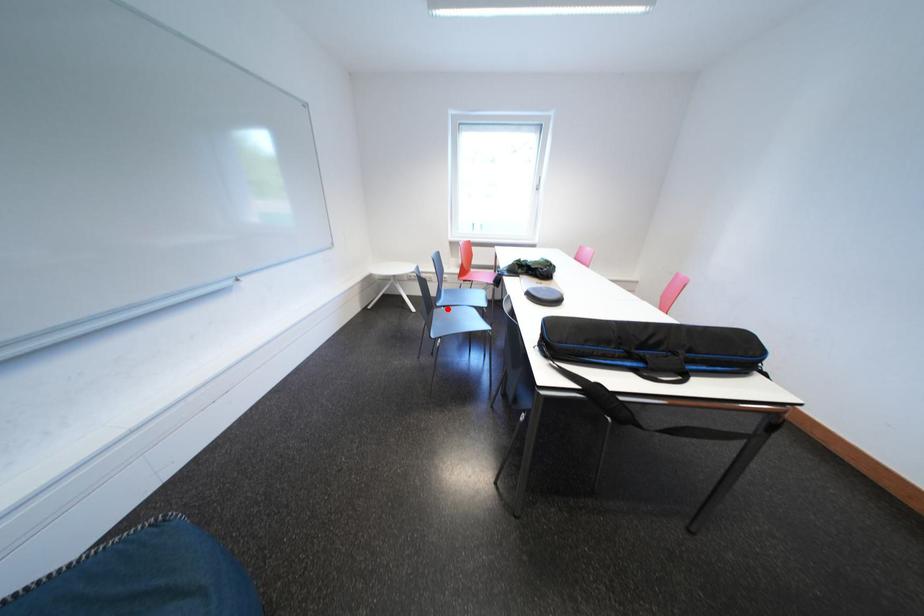
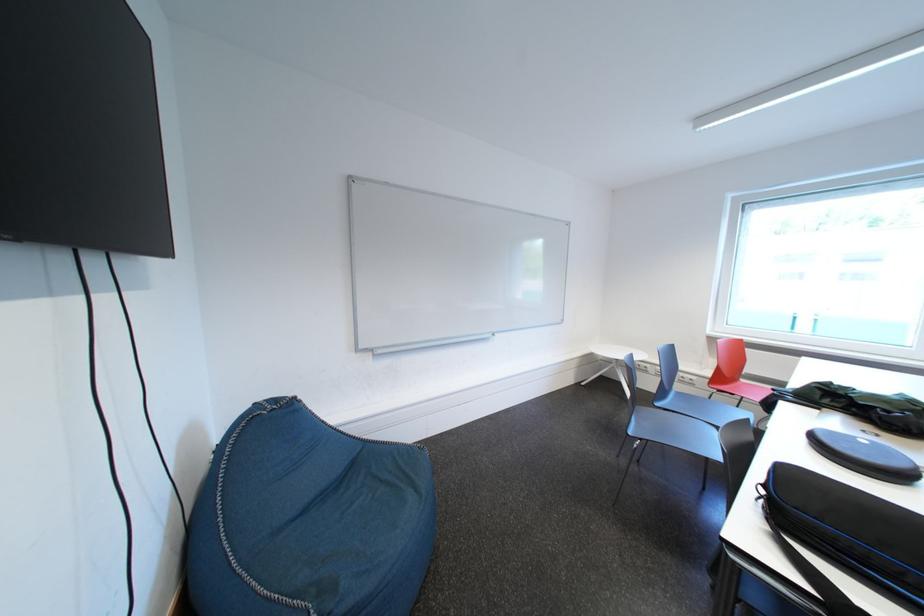
Find the pixel in the second image that matches the highlighted location in the first image.

(666, 408)